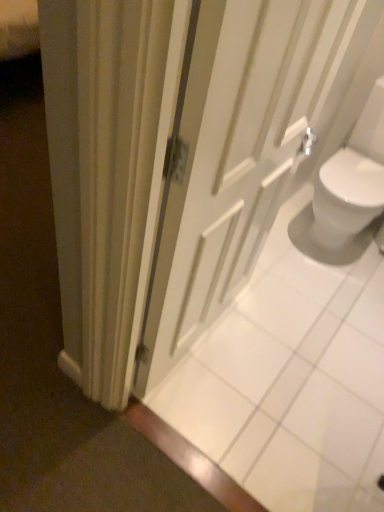
Question: From a real-world perspective, is white matte door at center below white glossy sink at right?

Choices:
 (A) yes
 (B) no

Answer: (B)

Question: Is white matte door at center to the right of white glossy sink at right from the viewer's perspective?

Choices:
 (A) yes
 (B) no

Answer: (B)

Question: From a real-world perspective, is white matte door at center physically above white glossy sink at right?

Choices:
 (A) yes
 (B) no

Answer: (A)

Question: Does white matte door at center have a greater width compared to white glossy sink at right?

Choices:
 (A) yes
 (B) no

Answer: (B)

Question: Is white matte door at center with white glossy sink at right?

Choices:
 (A) no
 (B) yes

Answer: (A)

Question: Is white matte door at center not near white glossy sink at right?

Choices:
 (A) no
 (B) yes

Answer: (A)

Question: Considering the relative positions of white glossy sink at right and white matte door at center in the image provided, is white glossy sink at right to the left of white matte door at center from the viewer's perspective?

Choices:
 (A) yes
 (B) no

Answer: (B)

Question: Is white glossy sink at right not close to white matte door at center?

Choices:
 (A) no
 (B) yes

Answer: (A)

Question: Is white glossy sink at right smaller than white matte door at center?

Choices:
 (A) yes
 (B) no

Answer: (B)

Question: Considering the relative sizes of white glossy sink at right and white matte door at center in the image provided, is white glossy sink at right wider than white matte door at center?

Choices:
 (A) yes
 (B) no

Answer: (A)

Question: Is white glossy sink at right not within white matte door at center?

Choices:
 (A) yes
 (B) no

Answer: (A)

Question: From a real-world perspective, is white glossy sink at right physically below white matte door at center?

Choices:
 (A) yes
 (B) no

Answer: (A)

Question: From their relative heights in the image, would you say white glossy sink at right is taller or shorter than white matte door at center?

Choices:
 (A) short
 (B) tall

Answer: (A)